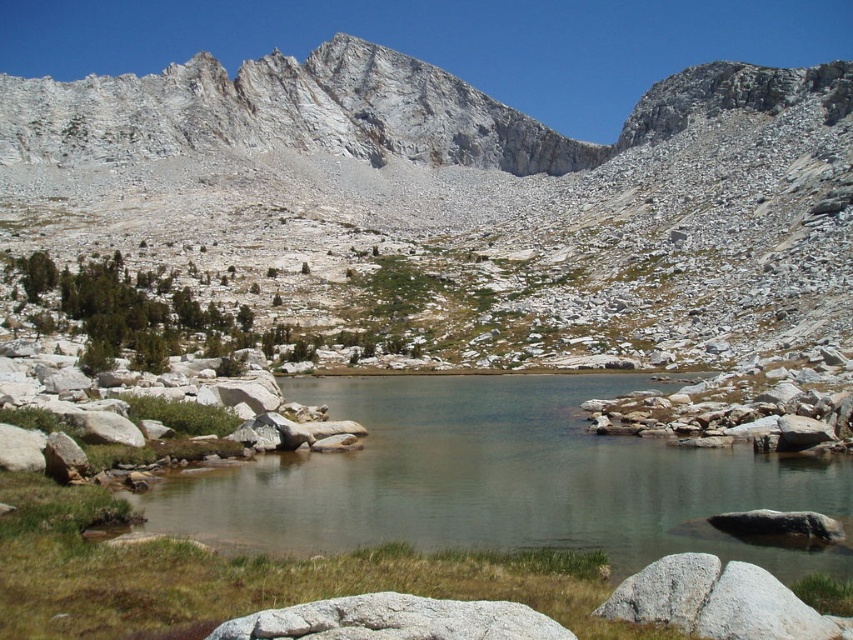
You are a hiker planning to cross the clear water at center to reach the white rocky mountain at upper center. The water is 3 feet deep. Can you safely cross the water to get to the mountain?

The distance between the white rocky mountain at upper center and the clear water at center is 322.46 feet. However, the depth of the water is only 3 feet, so it is safe to cross the clear water at center to reach the white rocky mountain at upper center.

You are standing at point (639, 548) and want to walk to the mountain peak visible in the distance. Is point (700, 177) located behind you or in front of you relative to your direction of travel?

Point (700, 177) is behind point (639, 548), so it is behind you relative to your direction of travel towards the mountain peak.